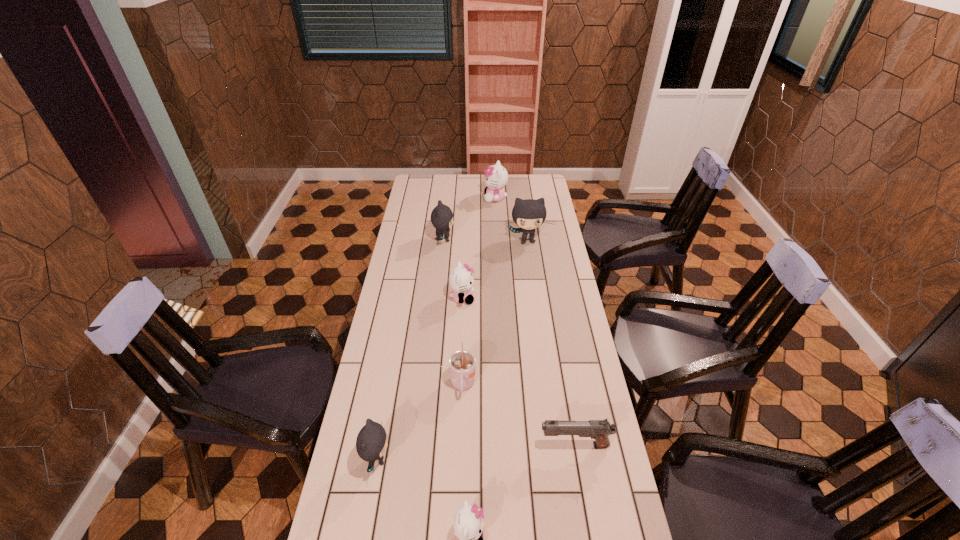
Identify the location of vacant space in between the cup and the biggest gray kitten. The image size is (960, 540). (495, 313).

In order to click on empty location between the gray gun and the biggest gray kitten in this screenshot , I will do `click(551, 343)`.

Find the location of a particular element. free space that is in between the nearest gray kitten and the second smallest gray kitten is located at coordinates (410, 349).

The height and width of the screenshot is (540, 960). Identify the location of blank region between the second farthest white kitten and the rightmost white kitten. (479, 248).

Locate an element on the screen. The image size is (960, 540). vacant space in between the farthest white kitten and the second nearest kitten is located at coordinates (436, 329).

Select which object appears as the second closest to the nearest object. Please provide its 2D coordinates. Your answer should be formatted as a tuple, i.e. [(x, y)], where the tuple contains the x and y coordinates of a point satisfying the conditions above.

[(599, 430)]

Identify which object is located as the seventh nearest to the fifth farthest object. Please provide its 2D coordinates. Your answer should be formatted as a tuple, i.e. [(x, y)], where the tuple contains the x and y coordinates of a point satisfying the conditions above.

[(496, 177)]

Identify the location of the third closest kitten to the shortest kitten. This screenshot has height=540, width=960. (441, 216).

Point out which kitten is positioned as the fourth nearest to the fifth farthest object. Please provide its 2D coordinates. Your answer should be formatted as a tuple, i.e. [(x, y)], where the tuple contains the x and y coordinates of a point satisfying the conditions above.

[(441, 216)]

Identify the location of gray kitten that is the nearest to the second gray kitten from right to left. (x=529, y=214).